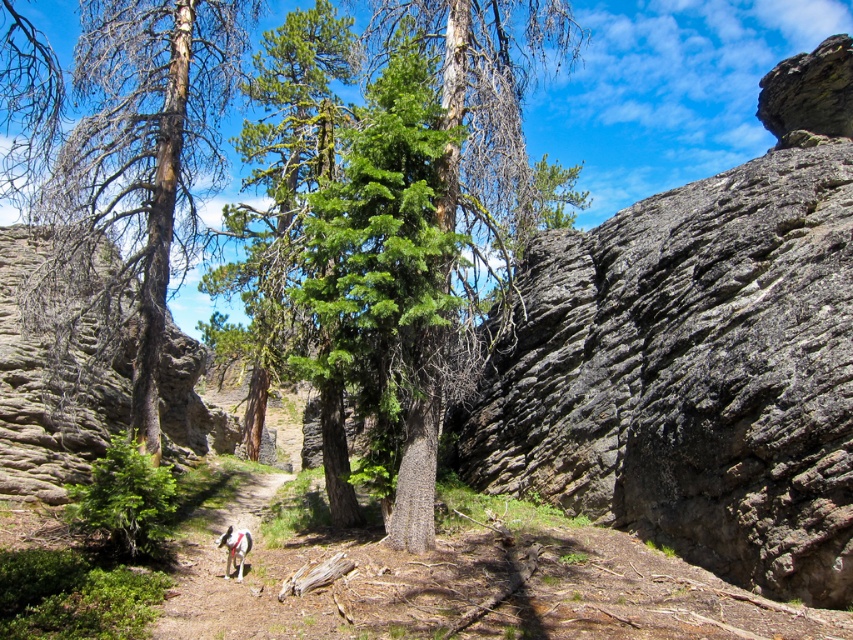
Question: Which point is farther to the camera?

Choices:
 (A) green textured tree at center
 (B) white fur dog at center
 (C) white fur dog at lower center

Answer: (A)

Question: Is green textured tree at center positioned before white fur dog at center?

Choices:
 (A) no
 (B) yes

Answer: (A)

Question: Which of these objects is positioned farthest from the green textured tree at center?

Choices:
 (A) white fur dog at lower center
 (B) white fur dog at center

Answer: (A)

Question: Which point is farther to the camera?

Choices:
 (A) green textured tree at center
 (B) white fur dog at center
 (C) white fur dog at lower center

Answer: (A)

Question: Can you confirm if white fur dog at center is positioned to the right of white fur dog at lower center?

Choices:
 (A) no
 (B) yes

Answer: (A)

Question: In this image, where is green textured tree at center located relative to white fur dog at center?

Choices:
 (A) above
 (B) below

Answer: (A)